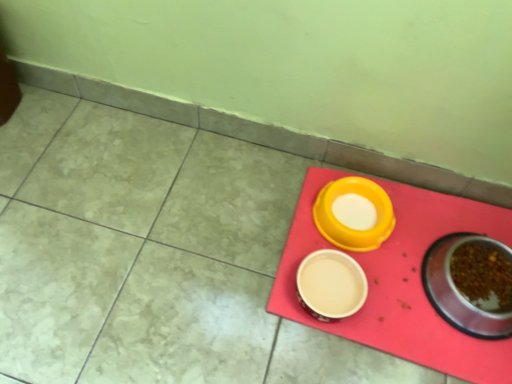
Where is `vacant space situated on the left part of yellow plastic bowl at center, which ranks as the 2th tableware in right-to-left order`? The width and height of the screenshot is (512, 384). vacant space situated on the left part of yellow plastic bowl at center, which ranks as the 2th tableware in right-to-left order is located at coordinates (270, 226).